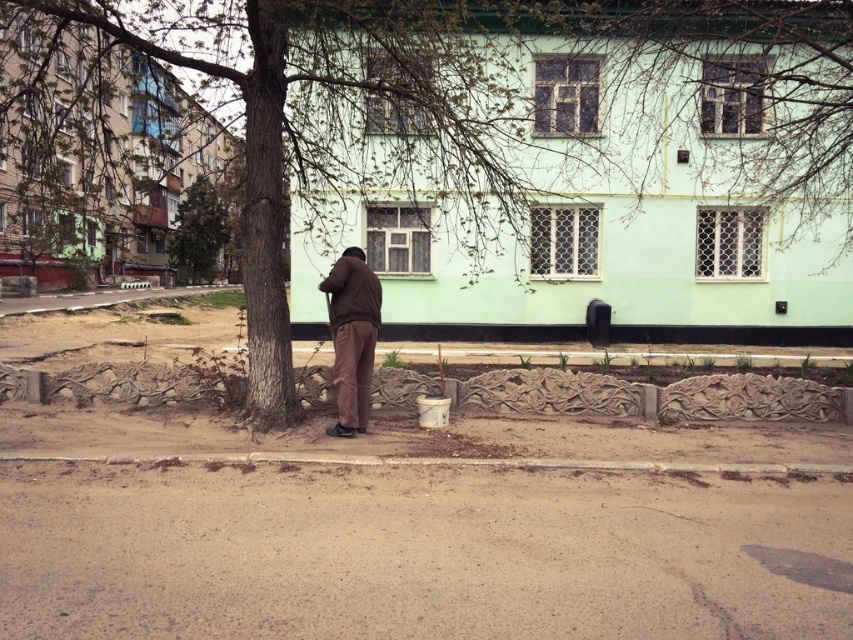
You are a delivery person who needs to place a package on the ground near the brown bark tree at center without getting your brown matte jacket at center wet. There is a sudden rain shower. Which object should you move to stay dry under the tree?

The brown matte jacket at center should be moved closer to the brown bark tree at center since they are 6.35 meters apart, so moving the jacket under the tree would keep it dry during the rain shower.

You are a delivery person trying to deliver a package to the address shown in the image. The package is too large to fit through the narrow path between the brown bark tree at center and the brown matte jacket at center. Which object should you move to make space for the package?

The brown bark tree at center is larger than the brown matte jacket at center, so you should move the brown matte jacket at center to make space for the package.

You are standing in the residential area and want to take a photo of the brown bark tree at center and the green leafy tree at upper left. Which tree should you focus on first to ensure both are in the frame?

You should focus on the brown bark tree at center first because it is in front of the green leafy tree at upper left, so adjusting the camera to include both would require ensuring the foreground tree is properly framed before considering the background one.